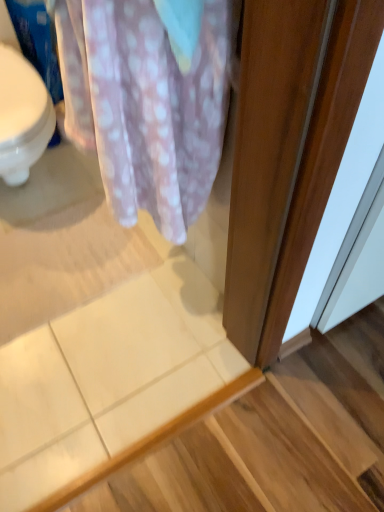
Question: Considering their positions, is white tile at lower left located in front of or behind pink polka dot fabric at upper left?

Choices:
 (A) behind
 (B) front

Answer: (A)

Question: Considering the positions of white tile at lower left and pink polka dot fabric at upper left in the image, is white tile at lower left wider or thinner than pink polka dot fabric at upper left?

Choices:
 (A) thin
 (B) wide

Answer: (B)

Question: From a real-world perspective, relative to pink polka dot fabric at upper left, is white tile at lower left vertically above or below?

Choices:
 (A) below
 (B) above

Answer: (A)

Question: From a real-world perspective, relative to white tile at lower left, is pink polka dot fabric at upper left vertically above or below?

Choices:
 (A) below
 (B) above

Answer: (B)

Question: In terms of size, does pink polka dot fabric at upper left appear bigger or smaller than white tile at lower left?

Choices:
 (A) big
 (B) small

Answer: (A)

Question: Does point (213, 87) appear closer or farther from the camera than point (367, 398)?

Choices:
 (A) closer
 (B) farther

Answer: (A)

Question: From the image's perspective, is pink polka dot fabric at upper left located above or below white tile at lower left?

Choices:
 (A) below
 (B) above

Answer: (B)